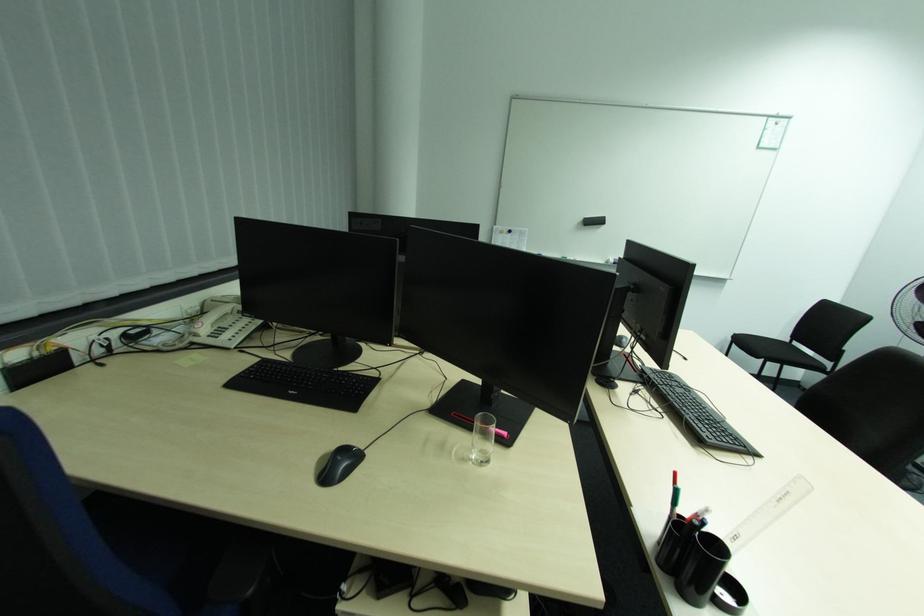
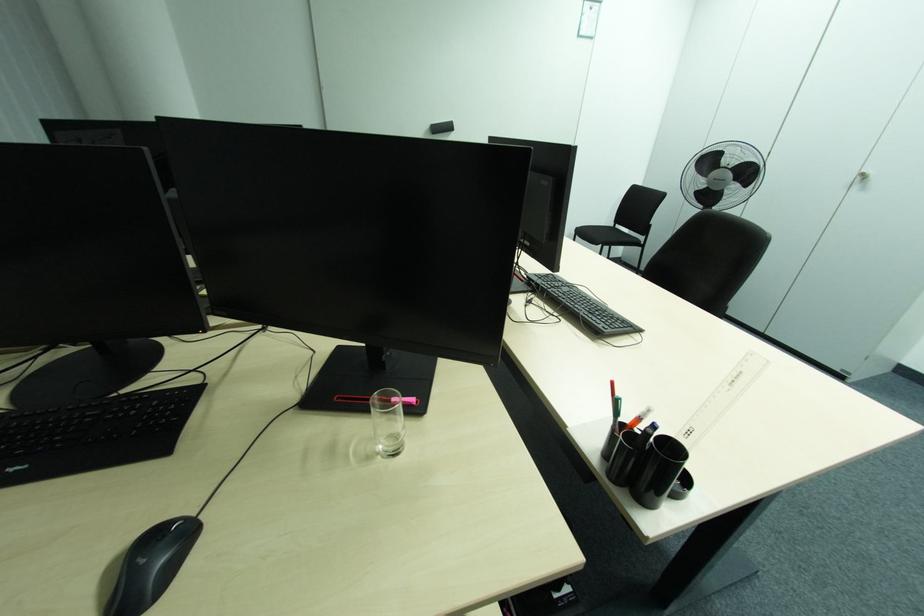
Question: Which direction would the cameraman need to move to produce the second image? Reply with the corresponding letter.

Choices:
 (A) Left
 (B) Right
 (C) Forward
 (D) Backward

Answer: (C)